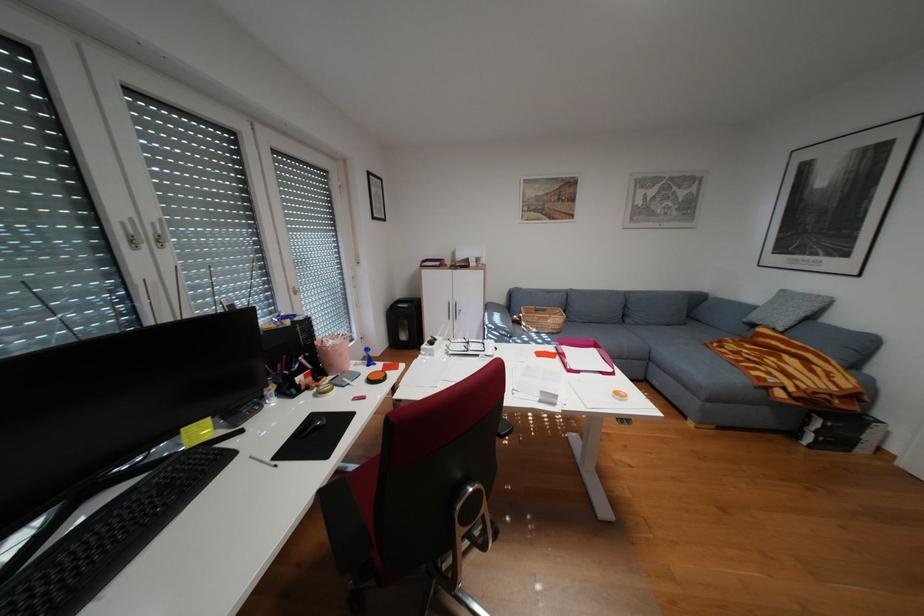
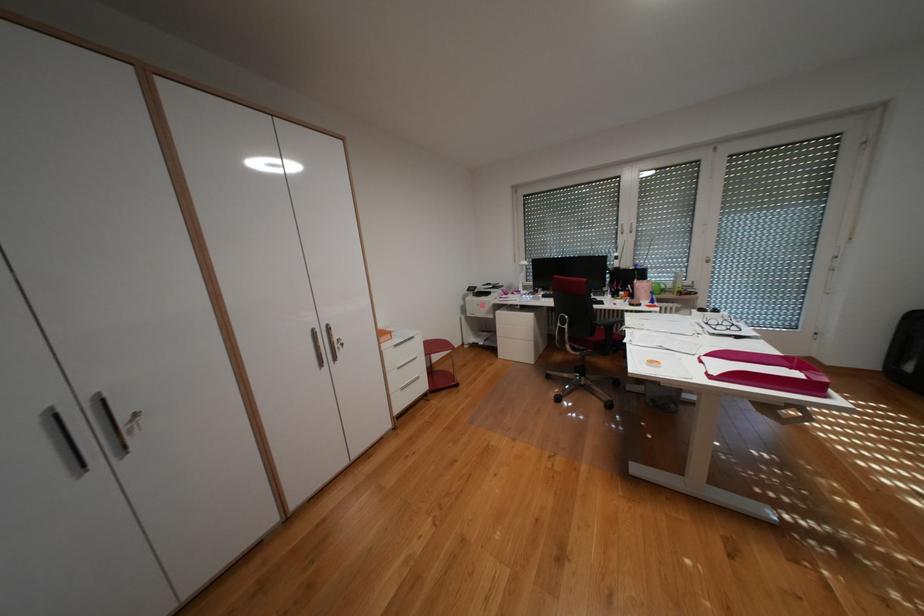
Find the pixel in the second image that matches (x=625, y=373) in the first image.

(723, 377)